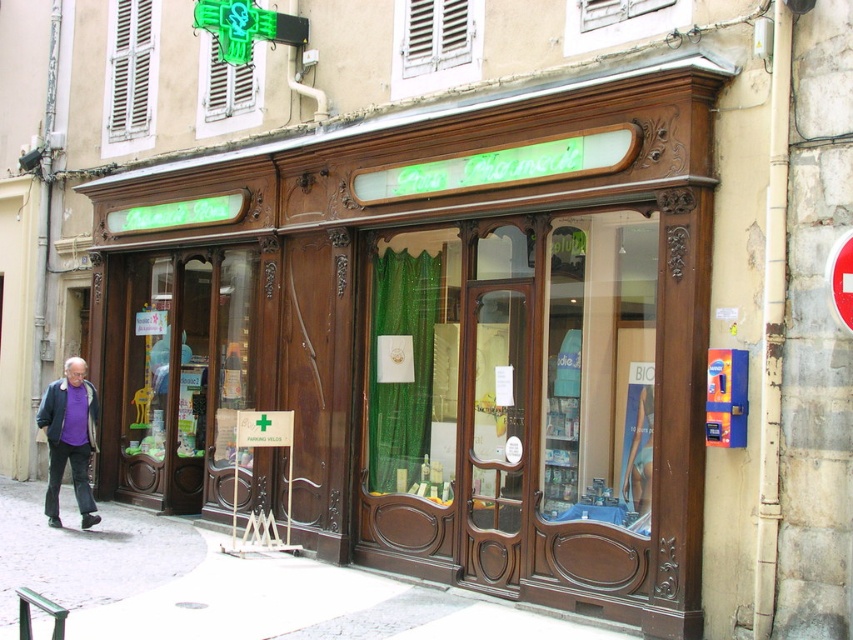
Does green fabric curtains at center have a lesser width compared to purple soft fabric jacket at lower left?

In fact, green fabric curtains at center might be wider than purple soft fabric jacket at lower left.

Does green fabric curtains at center have a smaller size compared to purple soft fabric jacket at lower left?

Actually, green fabric curtains at center might be larger than purple soft fabric jacket at lower left.

At what (x,y) coordinates should I click in order to perform the action: click on green fabric curtains at center. Please return your answer as a coordinate pair (x, y). Looking at the image, I should click on (512, 401).

Is green fabric curtains at center further to camera compared to white concrete pavement at lower center?

Yes, it is behind white concrete pavement at lower center.

Does green fabric curtains at center have a greater height compared to white concrete pavement at lower center?

Indeed, green fabric curtains at center has a greater height compared to white concrete pavement at lower center.

Find the location of a particular element. This screenshot has width=853, height=640. green fabric curtains at center is located at coordinates (512, 401).

What are the coordinates of `green fabric curtains at center` in the screenshot? It's located at (512, 401).

Is wooden storefront at center further to camera compared to white concrete pavement at lower center?

No, it is not.

Between wooden storefront at center and white concrete pavement at lower center, which one has more height?

wooden storefront at center

The width and height of the screenshot is (853, 640). Describe the element at coordinates (439, 337) in the screenshot. I see `wooden storefront at center` at that location.

At what (x,y) coordinates should I click in order to perform the action: click on wooden storefront at center. Please return your answer as a coordinate pair (x, y). Looking at the image, I should click on (439, 337).